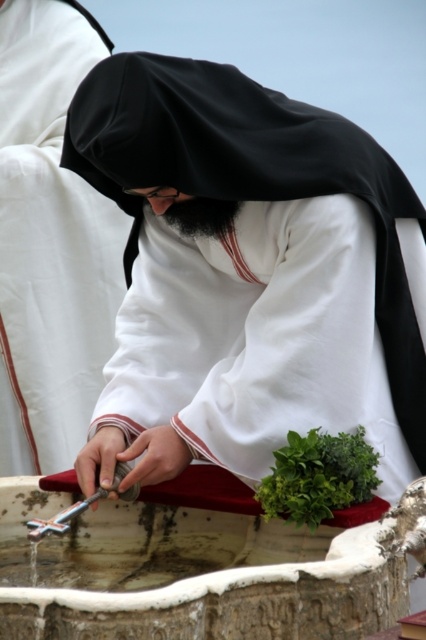
You are an assistant helping to prepare for a religious ceremony. You see the white matte cloth at center and the green leafy at center on the altar. Which object should you place first if the larger item needs to be positioned before the smaller one?

The white matte cloth at center is larger in size than the green leafy at center, so you should place the white matte cloth at center first before the smaller green leafy at center.

Looking at this image, what is the exact position of the white matte cloth at center in the image?

The white matte cloth at center is located at point (249,275).